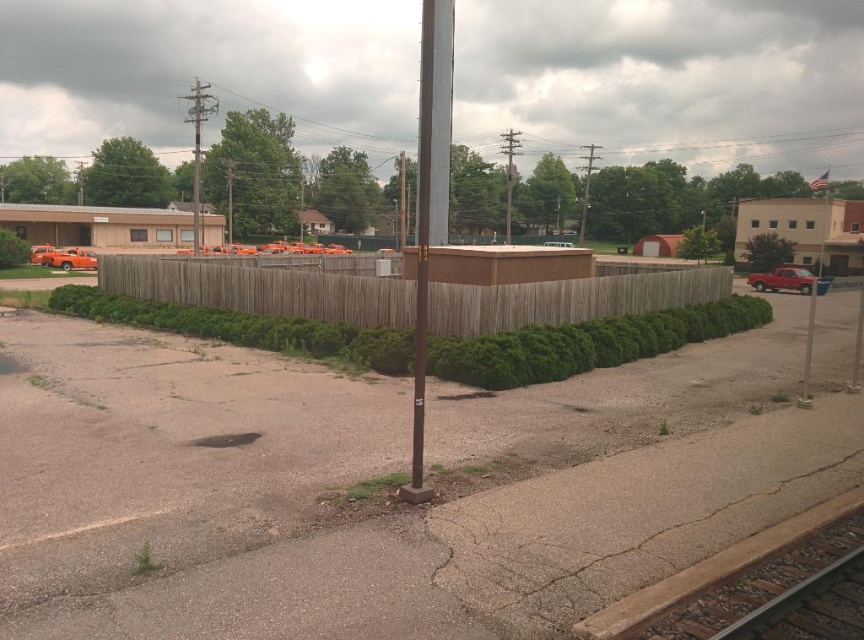
You are a pedestrian standing at the bottom of the image. You want to walk towards the brown metallic pole at center without stepping on the smooth metal train track at bottom right. Which direction should you move to avoid it?

The smooth metal train track at bottom right is located below the brown metallic pole at center. To avoid stepping on it, you should move to the left side of the brown metallic pole at center.